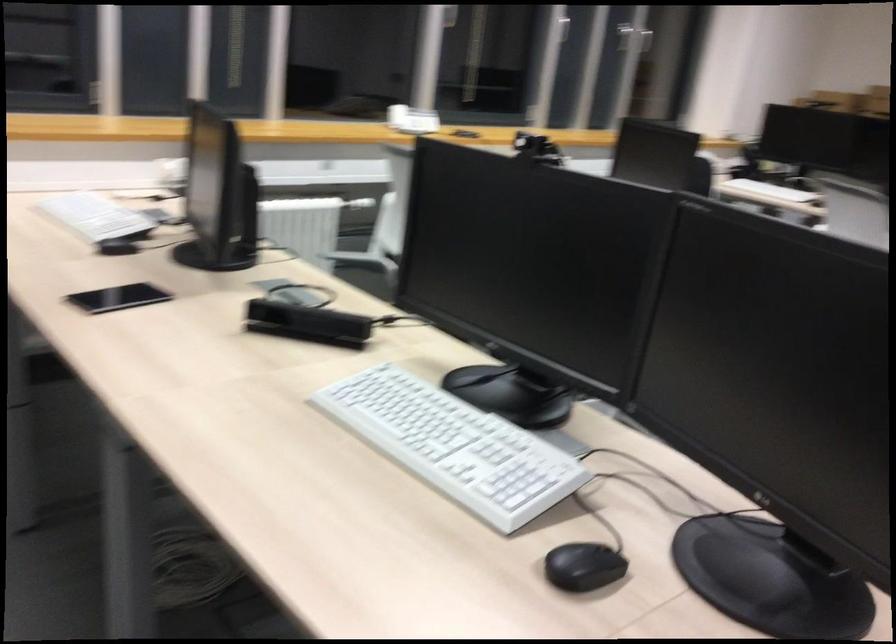
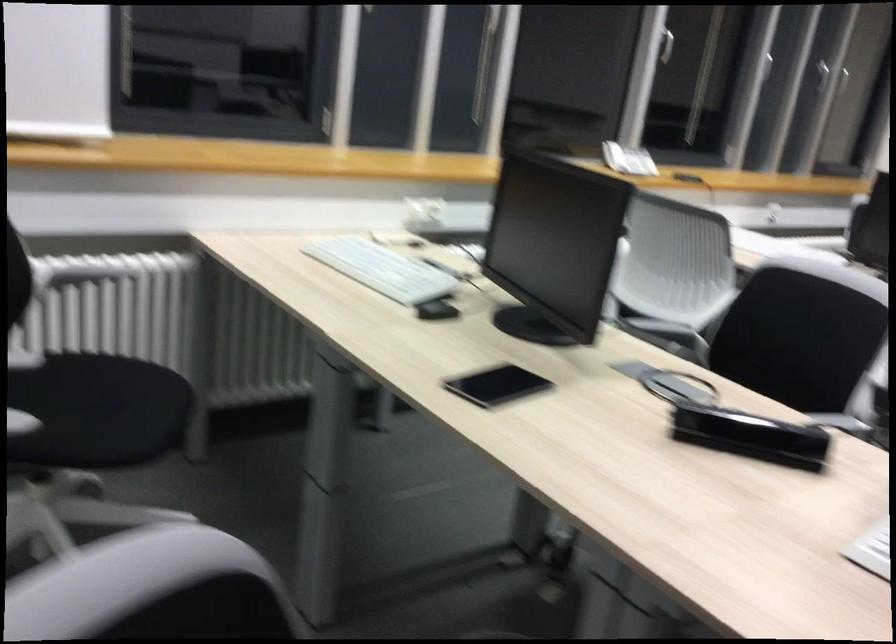
Find the pixel in the second image that matches the point at 127,242 in the first image.

(435, 297)